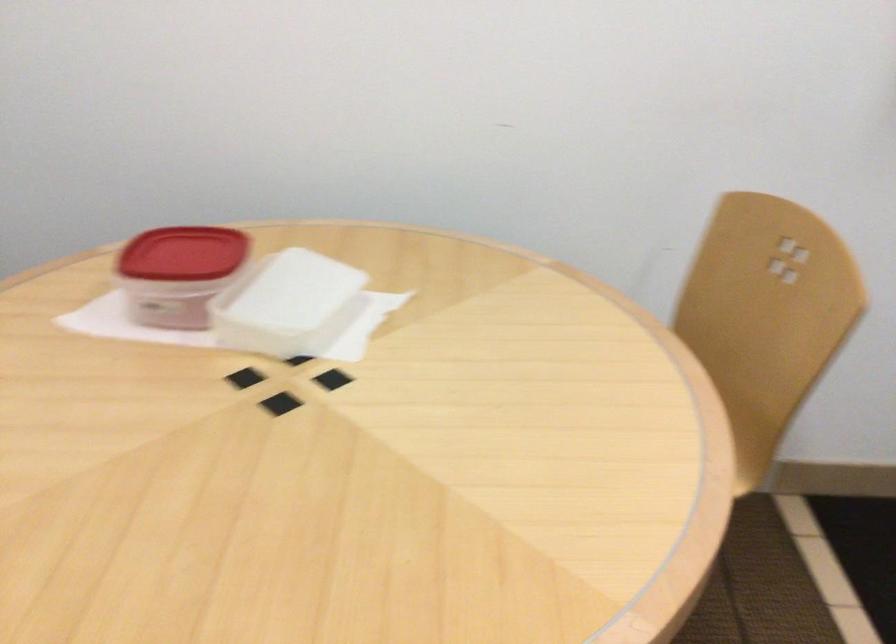
Locate an element on the screen. The image size is (896, 644). chair handle cutout is located at coordinates (788, 260).